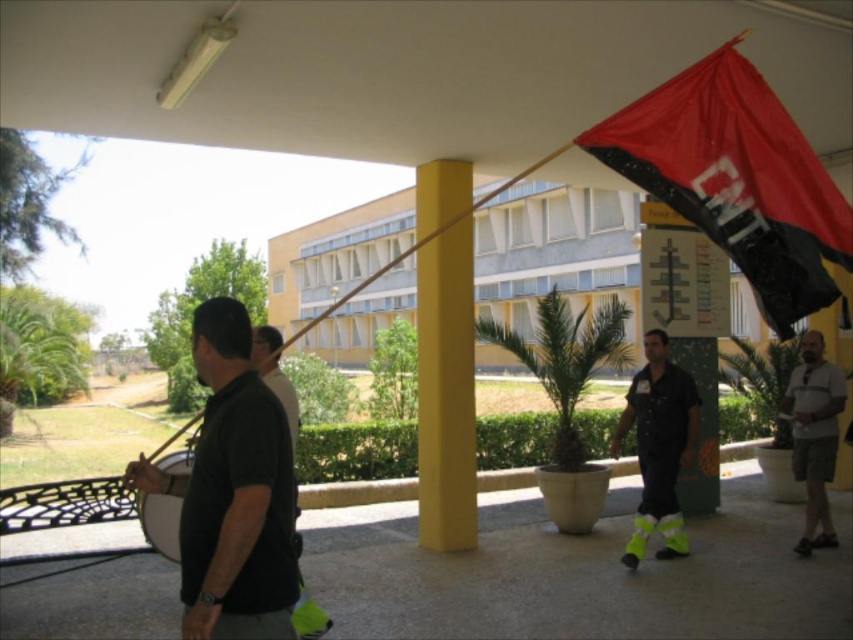
Who is shorter, black matte flag at upper right or neon yellow reflective pants at center?

black matte flag at upper right is shorter.

Which is more to the left, black matte flag at upper right or neon yellow reflective pants at center?

black matte flag at upper right

Identify the location of black matte flag at upper right. The width and height of the screenshot is (853, 640). (735, 180).

Does black matte flag at upper right have a greater width compared to white cotton t-shirt at center?

Indeed, black matte flag at upper right has a greater width compared to white cotton t-shirt at center.

Which is behind, point (822, 266) or point (822, 531)?

The point (822, 531) is behind.

This screenshot has height=640, width=853. I want to click on black matte flag at upper right, so click(x=735, y=180).

Between black matte shirt at left and neon yellow reflective pants at center, which one has less height?

black matte shirt at left

Between black matte shirt at left and neon yellow reflective pants at center, which one has more height?

With more height is neon yellow reflective pants at center.

Is point (236, 381) closer to viewer compared to point (657, 506)?

Yes, it is in front of point (657, 506).

This screenshot has width=853, height=640. I want to click on black matte shirt at left, so click(233, 492).